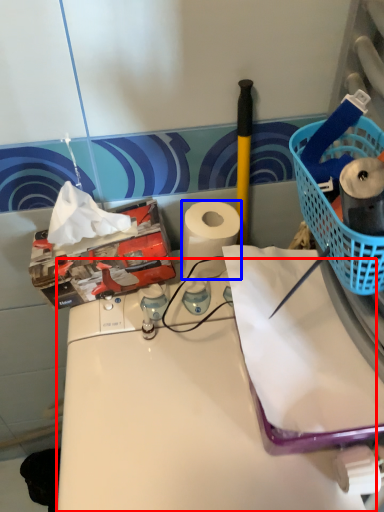
Question: Which point is closer to the camera, counter (highlighted by a red box) or paper towel (highlighted by a blue box)?

Choices:
 (A) counter
 (B) paper towel

Answer: (A)